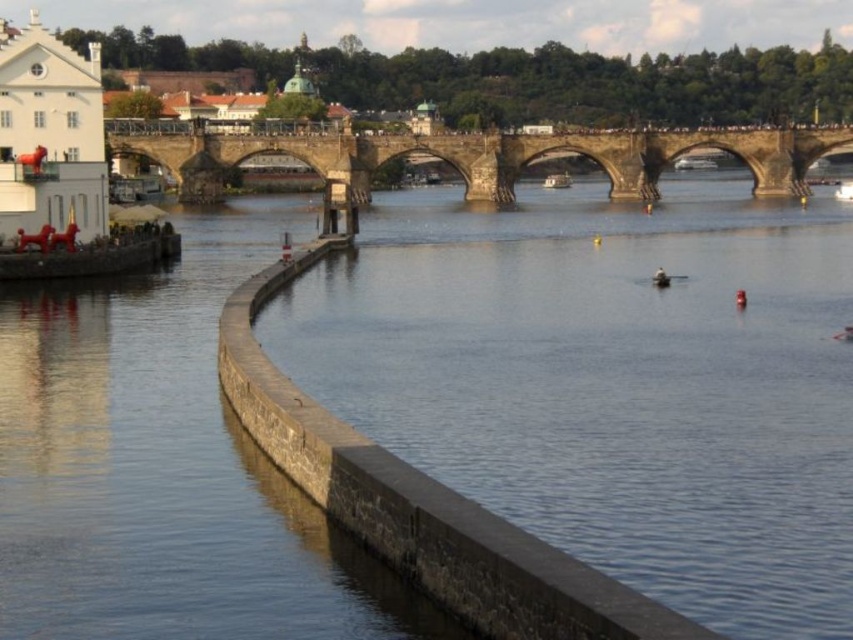
Can you confirm if clear blue water at center is positioned to the right of smooth wooden boat at center?

Incorrect, clear blue water at center is not on the right side of smooth wooden boat at center.

What do you see at coordinates (612, 381) in the screenshot?
I see `clear blue water at center` at bounding box center [612, 381].

In order to click on clear blue water at center in this screenshot , I will do tap(612, 381).

Does stone bridge at center have a larger size compared to white matte person at center?

Yes, stone bridge at center is bigger than white matte person at center.

Who is shorter, stone bridge at center or white matte person at center?

white matte person at center is shorter.

Measure the distance between point (637, 198) and camera.

They are 163.66 meters apart.

Locate an element on the screen. stone bridge at center is located at coordinates (485, 157).

Can you confirm if white plastic boat at center is shorter than white matte person at center?

No, white plastic boat at center is not shorter than white matte person at center.

Which is more to the right, white plastic boat at center or white matte person at center?

white plastic boat at center

You are a GUI agent. You are given a task and a screenshot of the screen. Output one action in this format:
    pyautogui.click(x=<x>, y=<y>)
    Task: Click on the white plastic boat at center
    The height and width of the screenshot is (640, 853).
    Given the screenshot: What is the action you would take?
    pyautogui.click(x=556, y=180)

Find the location of `white plastic boat at center`. white plastic boat at center is located at coordinates (556, 180).